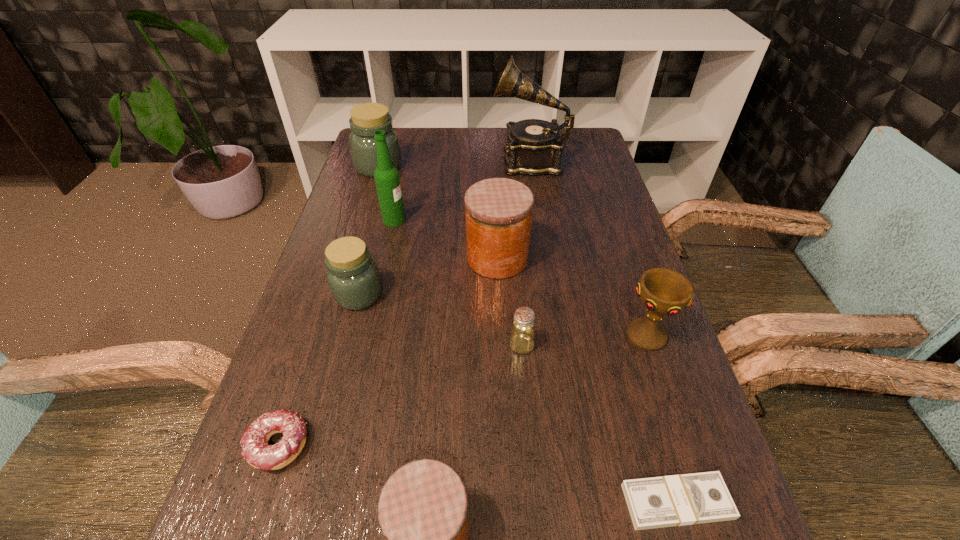
What are the coordinates of `object that is at the far left corner` in the screenshot? It's located at (367, 118).

This screenshot has height=540, width=960. I want to click on object located in the far right corner section of the desktop, so click(534, 147).

In the image, there is a desktop. Identify the location of vacant space at the far edge. (417, 143).

At what (x,y) coordinates should I click in order to perform the action: click on free space at the left edge of the desktop. Please return your answer as a coordinate pair (x, y). The width and height of the screenshot is (960, 540). Looking at the image, I should click on [281, 434].

At what (x,y) coordinates should I click in order to perform the action: click on vacant space at the right edge of the desktop. Please return your answer as a coordinate pair (x, y). Looking at the image, I should click on (600, 186).

Identify the location of vacant region at the far right corner of the desktop. The image size is (960, 540). (582, 140).

The width and height of the screenshot is (960, 540). Identify the location of vacant area that lies between the bigger orange jar and the ninth tallest object. (388, 352).

Where is `free spot between the nearer green jar and the doughnut`? The image size is (960, 540). free spot between the nearer green jar and the doughnut is located at coordinates (319, 370).

At what (x,y) coordinates should I click in order to perform the action: click on vacant space that's between the saltshaker and the bigger orange jar. Please return your answer as a coordinate pair (x, y). The width and height of the screenshot is (960, 540). Looking at the image, I should click on (510, 301).

Find the location of a particular element. The height and width of the screenshot is (540, 960). free space that is in between the eighth nearest object and the red chalice is located at coordinates (520, 278).